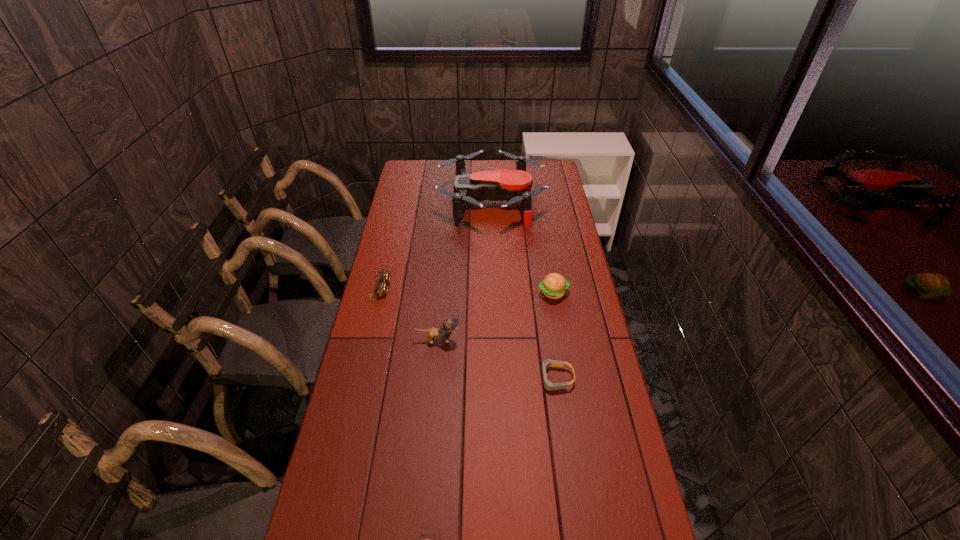
Find the location of `drone located in the right edge section of the desktop`. drone located in the right edge section of the desktop is located at coordinates (513, 186).

Identify the location of hamburger situated at the right edge. (554, 285).

Find the location of `goggles that is at the right edge`. goggles that is at the right edge is located at coordinates (548, 385).

The width and height of the screenshot is (960, 540). Find the location of `object at the far right corner`. object at the far right corner is located at coordinates (513, 186).

Where is `free space at the far edge of the desktop`? free space at the far edge of the desktop is located at coordinates (472, 172).

This screenshot has width=960, height=540. In the image, there is a desktop. What are the coordinates of `vacant space at the left edge` in the screenshot? It's located at (422, 193).

In the image, there is a desktop. Find the location of `vacant space at the right edge`. vacant space at the right edge is located at coordinates (560, 328).

Where is `free space between the second nearest object and the leftmost goggles`? free space between the second nearest object and the leftmost goggles is located at coordinates (468, 333).

Identify the location of free area in between the leftmost goggles and the drone. The height and width of the screenshot is (540, 960). tap(436, 245).

The width and height of the screenshot is (960, 540). What are the coordinates of `vacant area that lies between the rightmost goggles and the farthest object` in the screenshot? It's located at (523, 291).